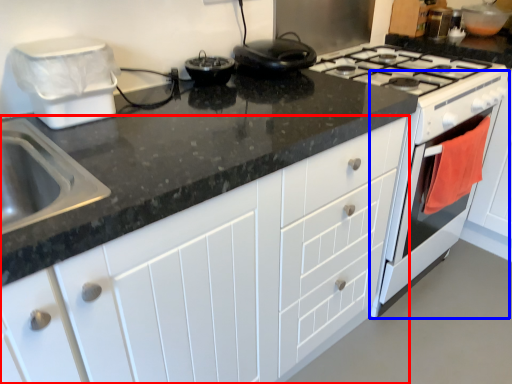
Question: Which point is closer to the camera, cabinetry (highlighted by a red box) or oven (highlighted by a blue box)?

Choices:
 (A) cabinetry
 (B) oven

Answer: (A)